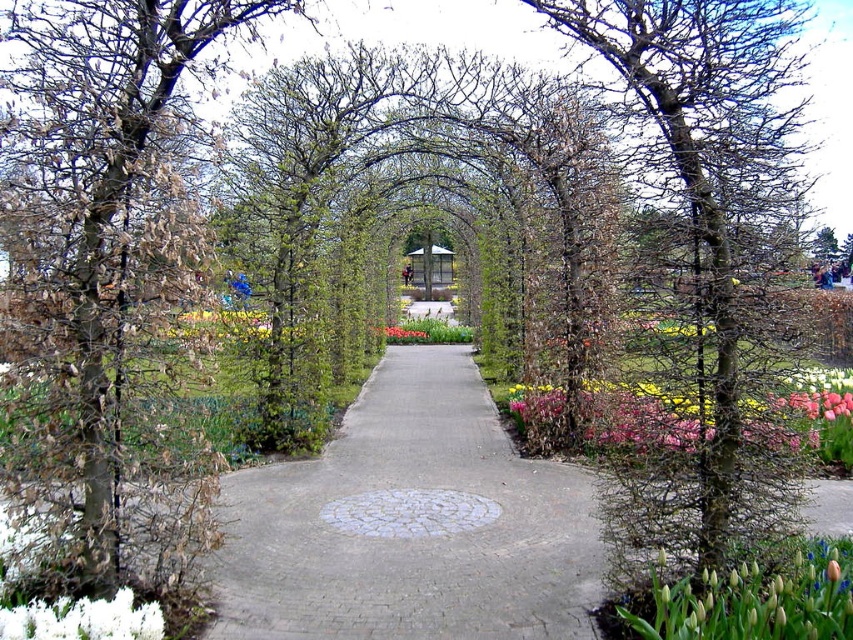
Which of these two, white fluffy flower at lower left or green leafy tree at center, stands shorter?

white fluffy flower at lower left is shorter.

Does point (112, 604) come farther from viewer compared to point (827, 248)?

No.

What do you see at coordinates (83, 620) in the screenshot?
I see `white fluffy flower at lower left` at bounding box center [83, 620].

The image size is (853, 640). I want to click on white fluffy flower at lower left, so click(x=83, y=620).

In the scene shown: Can you confirm if green matte tulip at lower right is positioned above pink matte flowers at lower right?

Incorrect, green matte tulip at lower right is not positioned above pink matte flowers at lower right.

Which is above, green matte tulip at lower right or pink matte flowers at lower right?

Positioned higher is pink matte flowers at lower right.

Describe the element at coordinates (755, 600) in the screenshot. I see `green matte tulip at lower right` at that location.

At what (x,y) coordinates should I click in order to perform the action: click on green matte tulip at lower right. Please return your answer as a coordinate pair (x, y). Looking at the image, I should click on [x=755, y=600].

Find the location of `green matte tulip at lower right`. green matte tulip at lower right is located at coordinates (755, 600).

Is green matte tulip at lower right further to camera compared to pink matte flower at center?

No.

Between point (718, 637) and point (425, 337), which one is positioned behind?

Positioned behind is point (425, 337).

The height and width of the screenshot is (640, 853). Identify the location of green matte tulip at lower right. (755, 600).